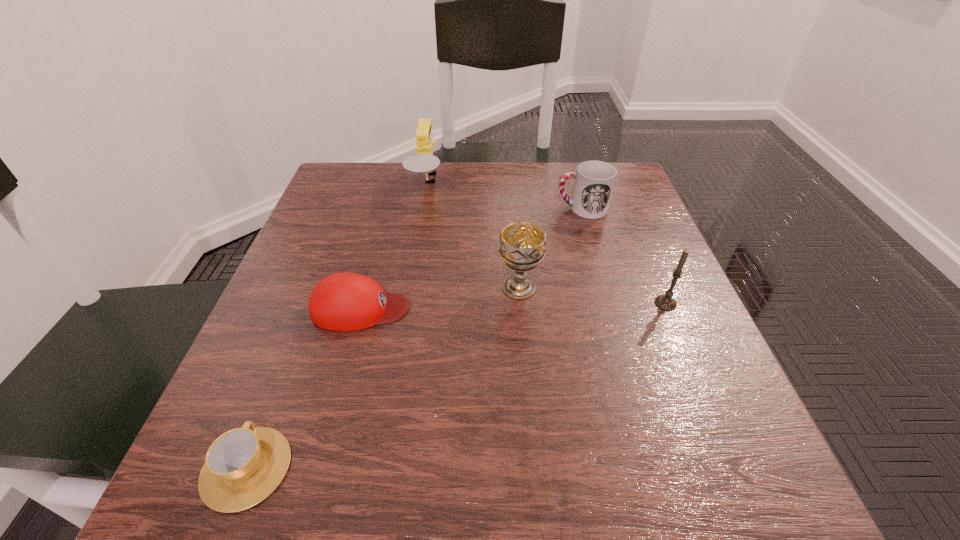
Locate an element on the screen. blank space at the right edge is located at coordinates (690, 399).

Locate an element on the screen. vacant space at the far right corner is located at coordinates (571, 186).

Image resolution: width=960 pixels, height=540 pixels. Find the location of `vacant space at the near right corner of the desktop`. vacant space at the near right corner of the desktop is located at coordinates point(684,470).

You are a GUI agent. You are given a task and a screenshot of the screen. Output one action in this format:
    pyautogui.click(x=<x>, y=<y>)
    Task: Click on the vacant space in between the sponge and the baseball cap
    The image size is (960, 540).
    Given the screenshot: What is the action you would take?
    point(394,246)

This screenshot has width=960, height=540. Find the location of `vacant area that lies between the candle and the nearest object`. vacant area that lies between the candle and the nearest object is located at coordinates (456, 386).

Image resolution: width=960 pixels, height=540 pixels. I want to click on vacant area that lies between the farther cup and the baseball cap, so click(x=471, y=258).

Locate an element on the screen. empty space that is in between the candle and the chalice is located at coordinates (592, 295).

Where is `vacant space that's between the sponge and the farther cup`? The width and height of the screenshot is (960, 540). vacant space that's between the sponge and the farther cup is located at coordinates (504, 196).

Locate an element on the screen. Image resolution: width=960 pixels, height=540 pixels. free area in between the sponge and the fourth object from left to right is located at coordinates (473, 236).

Identify the location of vacant region between the fifth tallest object and the nearer cup. (303, 388).